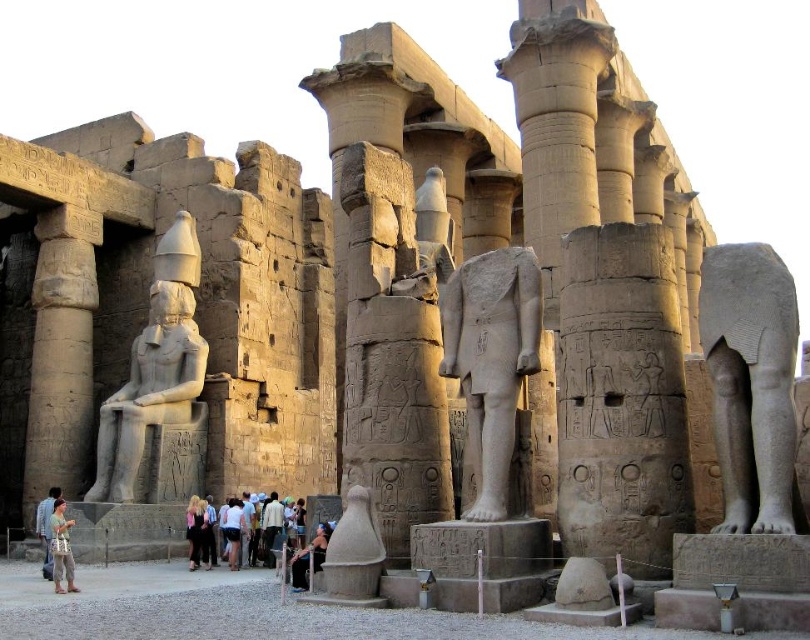
In the scene shown: How much distance is there between smooth stone vase at center and black fabric bag at center?

smooth stone vase at center is 22.84 feet from black fabric bag at center.

The image size is (810, 640). Identify the location of smooth stone vase at center. (352, 554).

Is gray stone elephant at right further to camera compared to light blue denim jeans at center?

No, gray stone elephant at right is in front of light blue denim jeans at center.

You are a GUI agent. You are given a task and a screenshot of the screen. Output one action in this format:
    pyautogui.click(x=<x>, y=<y>)
    Task: Click on the gray stone elephant at right
    The image size is (810, 640).
    Given the screenshot: What is the action you would take?
    pyautogui.click(x=751, y=385)

In the scene shown: Who is more forward, (x=702, y=280) or (x=301, y=541)?

Point (x=702, y=280)

The width and height of the screenshot is (810, 640). Identify the location of gray stone elephant at right. (751, 385).

Between point (580, 161) and point (293, 588), which one is positioned in front?

Point (293, 588) is in front.

Can you confirm if smooth stone column at center is positioned below black fabric bag at center?

No, smooth stone column at center is not below black fabric bag at center.

Between point (548, 10) and point (301, 586), which one is positioned behind?

Point (548, 10)

Locate an element on the screen. The image size is (810, 640). smooth stone column at center is located at coordinates (556, 122).